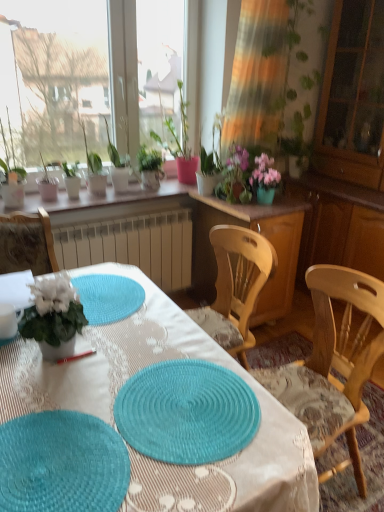
Question: Can you confirm if transparent glass cabinet at right is smaller than wooden cabinet at center?

Choices:
 (A) yes
 (B) no

Answer: (B)

Question: Does transparent glass cabinet at right have a larger size compared to wooden cabinet at center?

Choices:
 (A) yes
 (B) no

Answer: (A)

Question: Is transparent glass cabinet at right further to camera compared to wooden cabinet at center?

Choices:
 (A) no
 (B) yes

Answer: (B)

Question: Is transparent glass cabinet at right oriented towards wooden cabinet at center?

Choices:
 (A) yes
 (B) no

Answer: (A)

Question: Can you confirm if transparent glass cabinet at right is thinner than wooden cabinet at center?

Choices:
 (A) yes
 (B) no

Answer: (A)

Question: Considering the positions of teal woven mat at lower left, which is the 1th mat in left-to-right order, and transparent glass cabinet at right in the image, is teal woven mat at lower left, which is the 1th mat in left-to-right order, taller or shorter than transparent glass cabinet at right?

Choices:
 (A) tall
 (B) short

Answer: (B)

Question: In the image, is teal woven mat at lower left, which is the 1th mat in left-to-right order, positioned in front of or behind transparent glass cabinet at right?

Choices:
 (A) behind
 (B) front

Answer: (B)

Question: From a real-world perspective, is teal woven mat at lower left, which is the 1th mat in left-to-right order, physically located above or below transparent glass cabinet at right?

Choices:
 (A) below
 (B) above

Answer: (A)

Question: Which is correct: teal woven mat at lower left, positioned as the 2th mat in right-to-left order, is inside transparent glass cabinet at right, or outside of it?

Choices:
 (A) outside
 (B) inside

Answer: (A)

Question: From a real-world perspective, is teal woven mat at lower left, positioned as the 2th mat in right-to-left order, above or below teal woven placemat at center, arranged as the 1th mat when viewed from the right?

Choices:
 (A) below
 (B) above

Answer: (B)

Question: Considering the positions of teal woven mat at lower left, positioned as the 2th mat in right-to-left order, and teal woven placemat at center, the 2th mat positioned from the left, in the image, is teal woven mat at lower left, positioned as the 2th mat in right-to-left order, taller or shorter than teal woven placemat at center, the 2th mat positioned from the left,?

Choices:
 (A) tall
 (B) short

Answer: (B)

Question: Looking at the image, does teal woven mat at lower left, which is the 1th mat in left-to-right order, seem bigger or smaller compared to teal woven placemat at center, the 2th mat positioned from the left?

Choices:
 (A) big
 (B) small

Answer: (B)

Question: From the image's perspective, is teal woven mat at lower left, positioned as the 2th mat in right-to-left order, located above or below teal woven placemat at center, arranged as the 1th mat when viewed from the right?

Choices:
 (A) below
 (B) above

Answer: (A)

Question: Looking at their shapes, would you say green leafy plant at upper left, the 4th houseplant positioned from the left, is wider or thinner than teal woven placemat at center, the 2th mat positioned from the left?

Choices:
 (A) thin
 (B) wide

Answer: (A)

Question: Is green leafy plant at upper left, the 4th houseplant positioned from the left, inside or outside of teal woven placemat at center, the 2th mat positioned from the left?

Choices:
 (A) inside
 (B) outside

Answer: (B)